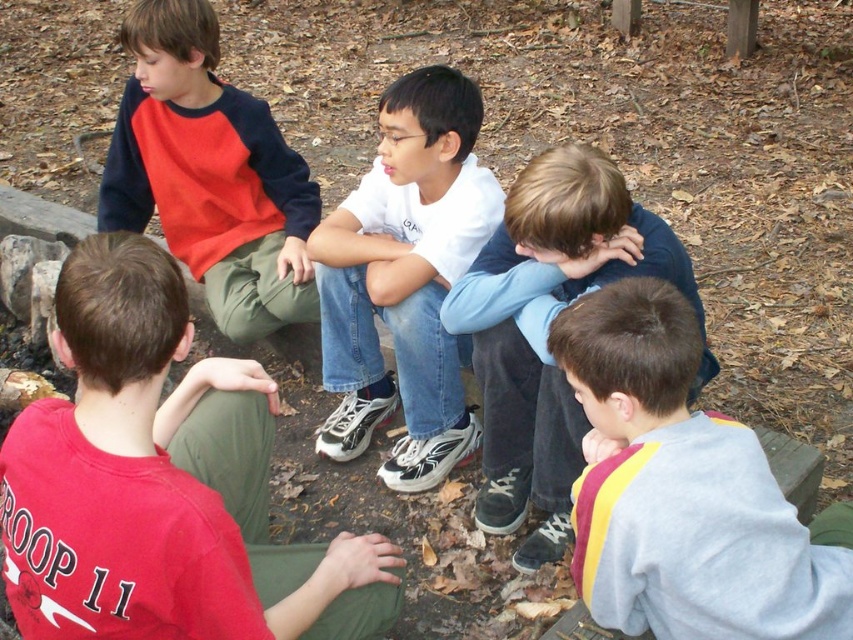
Is gray fleece sweatshirt at lower right thinner than light blue denim jeans at center?

Yes.

Which is more to the left, gray fleece sweatshirt at lower right or light blue denim jeans at center?

From the viewer's perspective, light blue denim jeans at center appears more on the left side.

Describe the element at coordinates (680, 490) in the screenshot. I see `gray fleece sweatshirt at lower right` at that location.

Where is `gray fleece sweatshirt at lower right`? The image size is (853, 640). gray fleece sweatshirt at lower right is located at coordinates (680, 490).

Is gray fleece sweatshirt at lower right taller than matte red and navy sweatshirt at left?

No.

Find the location of a particular element. gray fleece sweatshirt at lower right is located at coordinates point(680,490).

Find the location of a particular element. The height and width of the screenshot is (640, 853). gray fleece sweatshirt at lower right is located at coordinates (680, 490).

Between light blue denim jeans at center and matte red and navy sweatshirt at left, which one is positioned lower?

light blue denim jeans at center is lower down.

Which is above, light blue denim jeans at center or matte red and navy sweatshirt at left?

Positioned higher is matte red and navy sweatshirt at left.

This screenshot has height=640, width=853. Find the location of `light blue denim jeans at center`. light blue denim jeans at center is located at coordinates (547, 328).

Where is `light blue denim jeans at center`? The height and width of the screenshot is (640, 853). light blue denim jeans at center is located at coordinates (547, 328).